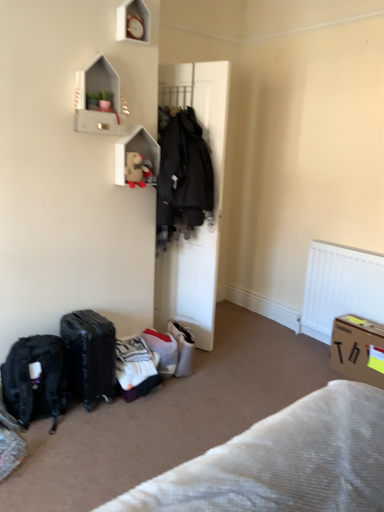
This screenshot has height=512, width=384. Describe the element at coordinates (358, 349) in the screenshot. I see `cardboard box at lower right` at that location.

What do you see at coordinates (133, 22) in the screenshot? This screenshot has width=384, height=512. I see `white matte clock at upper center, the 1th shelf when ordered from top to bottom` at bounding box center [133, 22].

Describe the element at coordinates (136, 151) in the screenshot. The width and height of the screenshot is (384, 512). I see `white matte wooden shelf at upper center, the first shelf ordered from the bottom` at that location.

This screenshot has width=384, height=512. What do you see at coordinates (207, 218) in the screenshot? I see `white matte door at center` at bounding box center [207, 218].

I want to click on cardboard box at lower right, so click(358, 349).

Identify the location of furniture in front of the fluffy beige plush at upper center. (284, 461).

Is white textured blanket at lower right next to fluffy beige plush at upper center?

No, white textured blanket at lower right is not making contact with fluffy beige plush at upper center.

From a real-world perspective, is white textured blanket at lower right on fluffy beige plush at upper center?

No, from a real-world perspective, white textured blanket at lower right is not on top of fluffy beige plush at upper center.

Who is bigger, white textured blanket at lower right or fluffy beige plush at upper center?

white textured blanket at lower right is bigger.

Is black matte suitcase at lower left positioned beyond the bounds of fluffy beige plush at upper center?

Indeed, black matte suitcase at lower left is completely outside fluffy beige plush at upper center.

Is black matte suitcase at lower left facing towards fluffy beige plush at upper center?

No, black matte suitcase at lower left is not oriented towards fluffy beige plush at upper center.

Considering the sizes of black matte suitcase at lower left and fluffy beige plush at upper center in the image, is black matte suitcase at lower left wider or thinner than fluffy beige plush at upper center?

Clearly, black matte suitcase at lower left has more width compared to fluffy beige plush at upper center.

Considering the points (82, 366) and (132, 175), which point is in front, point (82, 366) or point (132, 175)?

Point (82, 366)

Considering the sizes of objects white matte wooden shelf at upper center, the 2th shelf positioned from the top, and white textured blanket at lower right in the image provided, who is smaller, white matte wooden shelf at upper center, the 2th shelf positioned from the top, or white textured blanket at lower right?

white matte wooden shelf at upper center, the 2th shelf positioned from the top, is smaller.

How many degrees apart are the facing directions of white matte wooden shelf at upper center, the first shelf ordered from the bottom, and white textured blanket at lower right?

There is a 179-degree angle between the facing directions of white matte wooden shelf at upper center, the first shelf ordered from the bottom, and white textured blanket at lower right.

From a real-world perspective, is white matte wooden shelf at upper center, the first shelf ordered from the bottom, positioned under white textured blanket at lower right based on gravity?

No, from a real-world perspective, white matte wooden shelf at upper center, the first shelf ordered from the bottom, is not below white textured blanket at lower right.

Is the depth of white matte wooden shelf at upper center, the 2th shelf positioned from the top, less than that of white textured blanket at lower right?

No, white matte wooden shelf at upper center, the 2th shelf positioned from the top, is further to the viewer.

Can you tell me how much white matte clock at upper center, which ranks as the 2th shelf in bottom-to-top order, and black matte backpack at lower left differ in facing direction?

3.15 degrees separate the facing orientations of white matte clock at upper center, which ranks as the 2th shelf in bottom-to-top order, and black matte backpack at lower left.

Looking at the image, does white matte clock at upper center, the 1th shelf when ordered from top to bottom, seem bigger or smaller compared to black matte backpack at lower left?

white matte clock at upper center, the 1th shelf when ordered from top to bottom, is smaller than black matte backpack at lower left.

In the image, is white matte clock at upper center, the 1th shelf when ordered from top to bottom, positioned in front of or behind black matte backpack at lower left?

white matte clock at upper center, the 1th shelf when ordered from top to bottom, is behind black matte backpack at lower left.

Where is `backpack behind the white textured blanket at lower right`? The height and width of the screenshot is (512, 384). backpack behind the white textured blanket at lower right is located at coordinates (36, 380).

Looking at this image, can we say black matte backpack at lower left lies outside white textured blanket at lower right?

black matte backpack at lower left lies outside white textured blanket at lower right's area.

Measure the distance between black matte backpack at lower left and white textured blanket at lower right.

They are 1.40 meters apart.

Does point (9, 369) lie behind point (374, 426)?

Yes, it is behind point (374, 426).

Is cardboard box at lower right in front of white textured blanket at lower right?

No, cardboard box at lower right is further to the viewer.

From the picture: From the image's perspective, is cardboard box at lower right above or below white textured blanket at lower right?

cardboard box at lower right is situated lower than white textured blanket at lower right in the image.

Considering the sizes of objects cardboard box at lower right and white textured blanket at lower right in the image provided, who is taller, cardboard box at lower right or white textured blanket at lower right?

Standing taller between the two is cardboard box at lower right.

From a real-world perspective, is cardboard box at lower right on top of white textured blanket at lower right?

No.

From a real-world perspective, between white textured blanket at lower right and white matte door at center, who is vertically higher?

white matte door at center.

Based on the photo, is white textured blanket at lower right touching white matte door at center?

No, white textured blanket at lower right is not with white matte door at center.

What's the angular difference between white textured blanket at lower right and white matte door at center's facing directions?

The facing directions of white textured blanket at lower right and white matte door at center are 72.3 degrees apart.

Is white textured blanket at lower right positioned with its back to white matte door at center?

No.

In the image, there is a fluffy beige plush at upper center. Where is `furniture below it (from a real-world perspective)`? The height and width of the screenshot is (512, 384). furniture below it (from a real-world perspective) is located at coordinates (284, 461).

Locate an element on the screen. The width and height of the screenshot is (384, 512). luggage that appears in front of the fluffy beige plush at upper center is located at coordinates (90, 355).

Considering their positions, is fluffy beige plush at upper center positioned closer to white matte door at center than black matte backpack at lower left?

Among the two, fluffy beige plush at upper center is located nearer to white matte door at center.

Considering their positions, is white matte door at center positioned closer to concrete textured shelf at upper left than black matte suitcase at lower left?

Among the two, white matte door at center is located nearer to concrete textured shelf at upper left.

Considering their positions, is cardboard box at lower right positioned further to white matte clock at upper center, the 1th shelf when ordered from top to bottom, than fluffy beige plush at upper center?

cardboard box at lower right is positioned further to the anchor white matte clock at upper center, the 1th shelf when ordered from top to bottom.

Looking at the image, which one is located closer to white matte wooden shelf at upper center, the first shelf ordered from the bottom, white matte clock at upper center, which ranks as the 2th shelf in bottom-to-top order, or cardboard box at lower right?

Among the two, white matte clock at upper center, which ranks as the 2th shelf in bottom-to-top order, is located nearer to white matte wooden shelf at upper center, the first shelf ordered from the bottom.

Estimate the real-world distances between objects in this image. Which object is closer to concrete textured shelf at upper left, cardboard box at lower right or white matte door at center?

white matte door at center.

Considering their positions, is concrete textured shelf at upper left positioned further to black matte backpack at lower left than white matte door at center?

Based on the image, concrete textured shelf at upper left appears to be further to black matte backpack at lower left.

When comparing their distances from black matte suitcase at lower left, does cardboard box at lower right or white matte wooden shelf at upper center, the 2th shelf positioned from the top, seem further?

cardboard box at lower right lies further to black matte suitcase at lower left than the other object.

Looking at the image, which one is located further to cardboard box at lower right, white matte clock at upper center, which ranks as the 2th shelf in bottom-to-top order, or black matte suitcase at lower left?

white matte clock at upper center, which ranks as the 2th shelf in bottom-to-top order, is positioned further to the anchor cardboard box at lower right.

Where is `door between fluffy beige plush at upper center and black matte backpack at lower left from top to bottom`? This screenshot has width=384, height=512. door between fluffy beige plush at upper center and black matte backpack at lower left from top to bottom is located at coordinates (207, 218).

Where is `toy between concrete textured shelf at upper left and black matte backpack at lower left from top to bottom`? The width and height of the screenshot is (384, 512). toy between concrete textured shelf at upper left and black matte backpack at lower left from top to bottom is located at coordinates [137, 169].

Identify the location of shelf between white matte clock at upper center, which ranks as the 2th shelf in bottom-to-top order, and cardboard box at lower right from top to bottom. The width and height of the screenshot is (384, 512). (136, 151).

Find the location of `luggage between white textured blanket at lower right and white matte door at center from front to back`. luggage between white textured blanket at lower right and white matte door at center from front to back is located at coordinates (90, 355).